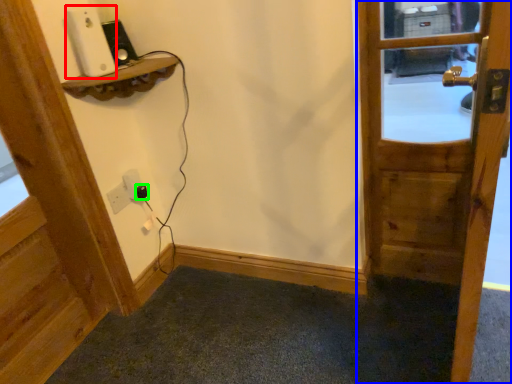
Question: Which object is the farthest from ipod (highlighted by a red box)? Choose among these: door (highlighted by a blue box) or plug (highlighted by a green box).

Choices:
 (A) door
 (B) plug

Answer: (A)